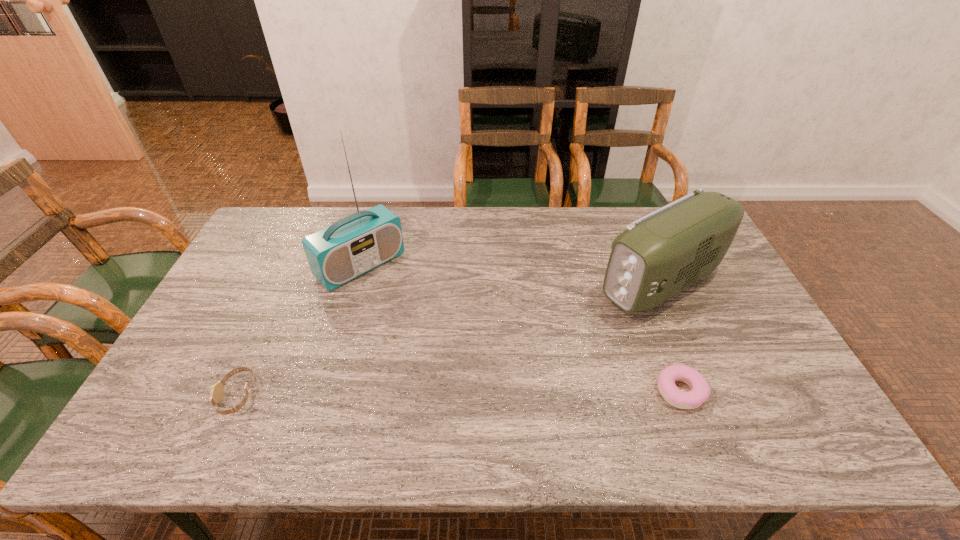
Locate an element on the screen. This screenshot has width=960, height=540. object at the near left corner is located at coordinates (217, 390).

At what (x,y) coordinates should I click in order to perform the action: click on object that is at the far right corner. Please return your answer as a coordinate pair (x, y). The height and width of the screenshot is (540, 960). Looking at the image, I should click on [x=660, y=254].

The image size is (960, 540). Find the location of `blank area at the far edge`. blank area at the far edge is located at coordinates (474, 220).

Find the location of a particular element. The image size is (960, 540). vacant space at the near edge of the desktop is located at coordinates (445, 389).

In the image, there is a desktop. Where is `vacant region at the left edge`? The image size is (960, 540). vacant region at the left edge is located at coordinates (237, 296).

In the image, there is a desktop. Identify the location of free space at the right edge. (728, 306).

In the image, there is a desktop. At what (x,y) coordinates should I click in order to perform the action: click on vacant space at the far right corner. Please return your answer as a coordinate pair (x, y). Image resolution: width=960 pixels, height=540 pixels. Looking at the image, I should click on 649,211.

Identify the location of free space at the near right corner. (748, 391).

Where is `vacant space that is in between the shorter radio receiver and the taller radio receiver`? Image resolution: width=960 pixels, height=540 pixels. vacant space that is in between the shorter radio receiver and the taller radio receiver is located at coordinates (511, 274).

Identify the location of free point between the right radio receiver and the shortest object. (671, 337).